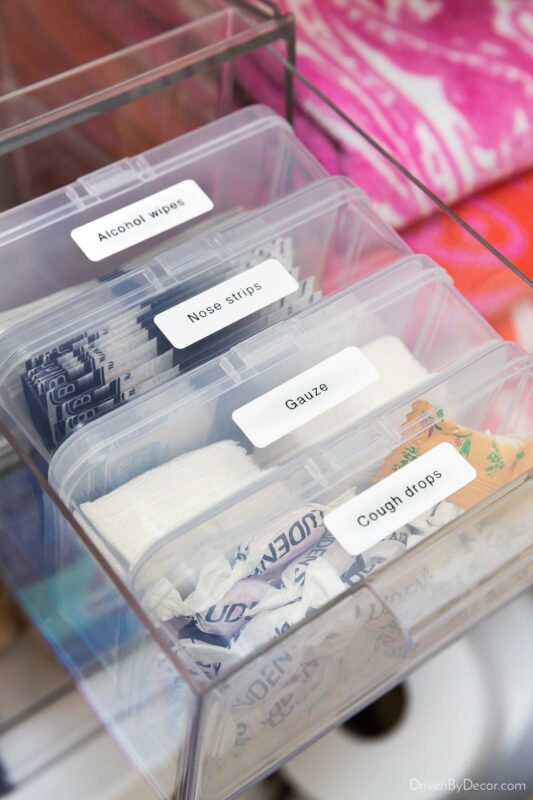
Identify the location of drawer. The height and width of the screenshot is (800, 533). (244, 726).